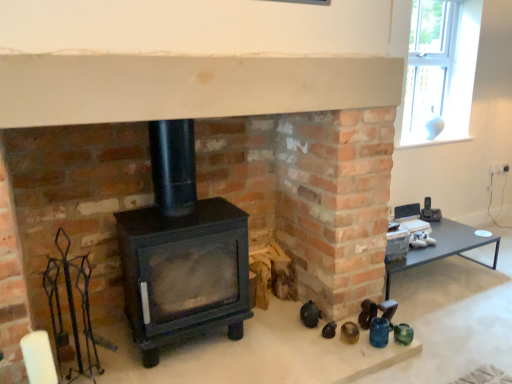
Where is `free region under matte black table at right (from a real-world perspective)`? Image resolution: width=512 pixels, height=384 pixels. free region under matte black table at right (from a real-world perspective) is located at coordinates (425, 276).